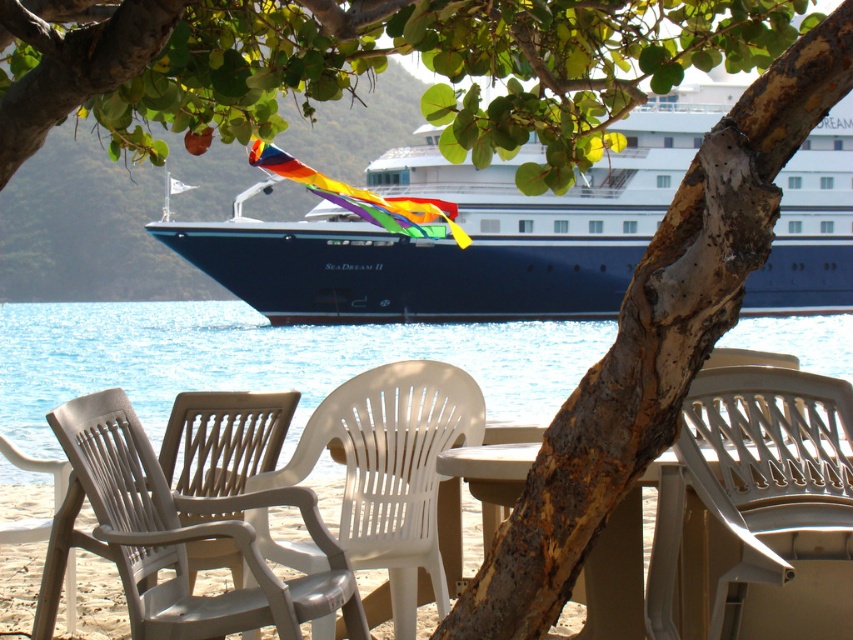
Question: Can you confirm if white plastic beach chair at lower center is smaller than white plastic chair at center?

Choices:
 (A) yes
 (B) no

Answer: (A)

Question: Among these points, which one is farthest from the camera?

Choices:
 (A) (228, 604)
 (B) (422, 509)
 (C) (383, 170)

Answer: (C)

Question: Can you confirm if transparent plastic water at center is bigger than white plastic chair at lower right?

Choices:
 (A) no
 (B) yes

Answer: (B)

Question: Is white plastic chair at lower right above white plastic beach chair at lower center?

Choices:
 (A) no
 (B) yes

Answer: (B)

Question: Which point is farther to the camera?

Choices:
 (A) (836, 196)
 (B) (277, 364)
 (C) (712, 436)

Answer: (A)

Question: Which is farther from the white plastic chair at center?

Choices:
 (A) blue glossy cruise ship at center
 (B) white plastic beach chair at lower center

Answer: (A)